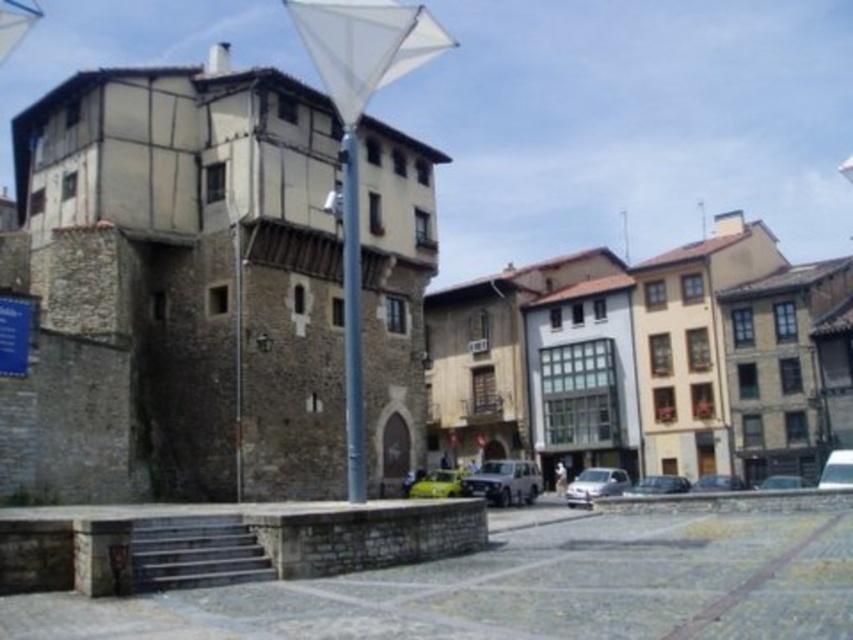
You are a delivery driver who needs to park your metallic silver suv at center in this urban area. Based on the scene description, is there enough space to park the SUV without blocking the steps leading to the stone building?

The metallic silver suv at center is located at coordinates point (503, 481). Since the SUV is parked centrally in the scene, it is likely positioned away from the steps leading to the stone building. Therefore, there should be sufficient space to park without blocking the steps.

You are standing in the urban scene described and want to take a photo of the metallic silver suv at center. Considering the distance, will you need a zoom lens to capture the entire vehicle in the frame?

The metallic silver suv at center is 75.11 meters away from the viewer. A zoom lens would be necessary to capture the entire vehicle at that distance.

You are standing in the urban scene and want to place a small bench between the two points labeled point (611, 493) and point (671, 474). Given that the bench is 0.5 meters long, will it fit if placed directly between them?

The distance between point (611, 493) and point (671, 474) is approximately 0.071 units. Since the bench is 0.5 meters long, the bench will not fit between them as the space is smaller than required.